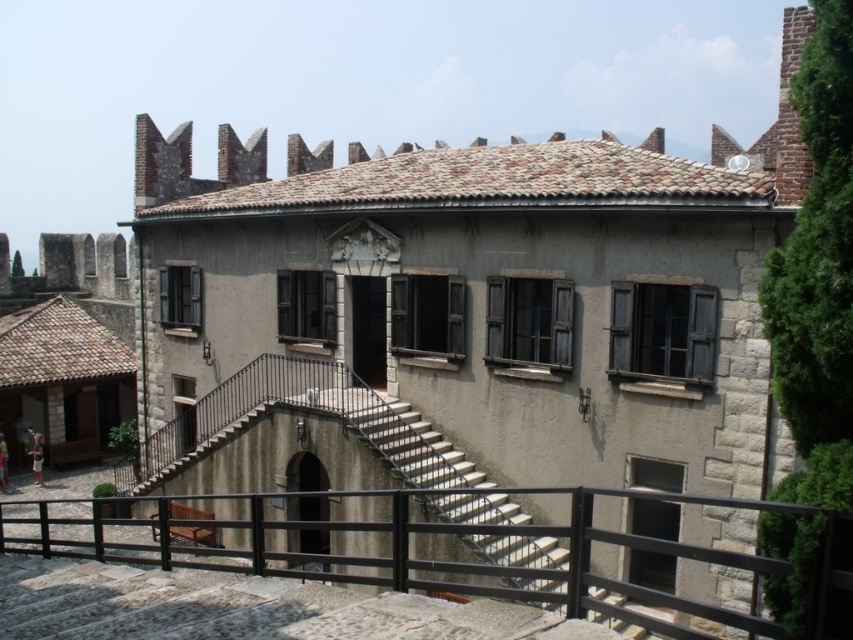
Looking at this image, between black metal railing at lower center and white concrete stairs at center, which one is positioned higher?

white concrete stairs at center is higher up.

Is black metal railing at lower center further to the viewer compared to white concrete stairs at center?

No.

Locate an element on the screen. black metal railing at lower center is located at coordinates 427,552.